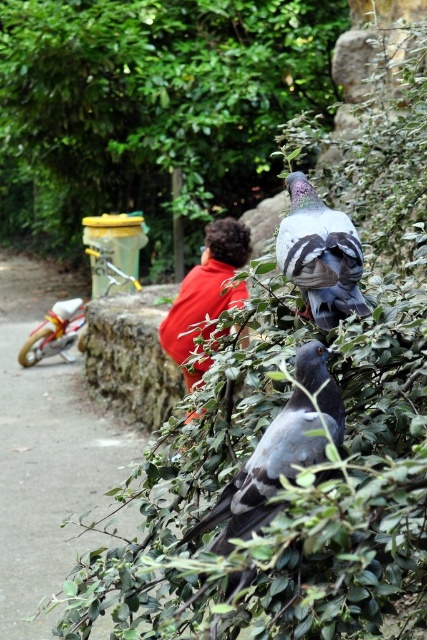
Question: Does green leafy tree at upper center appear under gray matte pigeon at center?

Choices:
 (A) yes
 (B) no

Answer: (B)

Question: Among these points, which one is farthest from the camera?

Choices:
 (A) (169, 352)
 (B) (239, 522)
 (C) (55, 209)
 (D) (350, 284)

Answer: (C)

Question: Which object appears closest to the camera in this image?

Choices:
 (A) gray matte pigeon at center
 (B) green leafy tree at upper center
 (C) red cotton shirt at center
 (D) gray matte pigeon at upper center

Answer: (A)

Question: Does gray matte pigeon at upper center have a larger size compared to red cotton shirt at center?

Choices:
 (A) yes
 (B) no

Answer: (A)

Question: Estimate the real-world distances between objects in this image. Which object is closer to the green leafy tree at upper center?

Choices:
 (A) gray matte pigeon at upper center
 (B) red cotton shirt at center
 (C) gray matte pigeon at center

Answer: (B)

Question: Is green leafy tree at upper center bigger than gray matte pigeon at upper center?

Choices:
 (A) yes
 (B) no

Answer: (B)